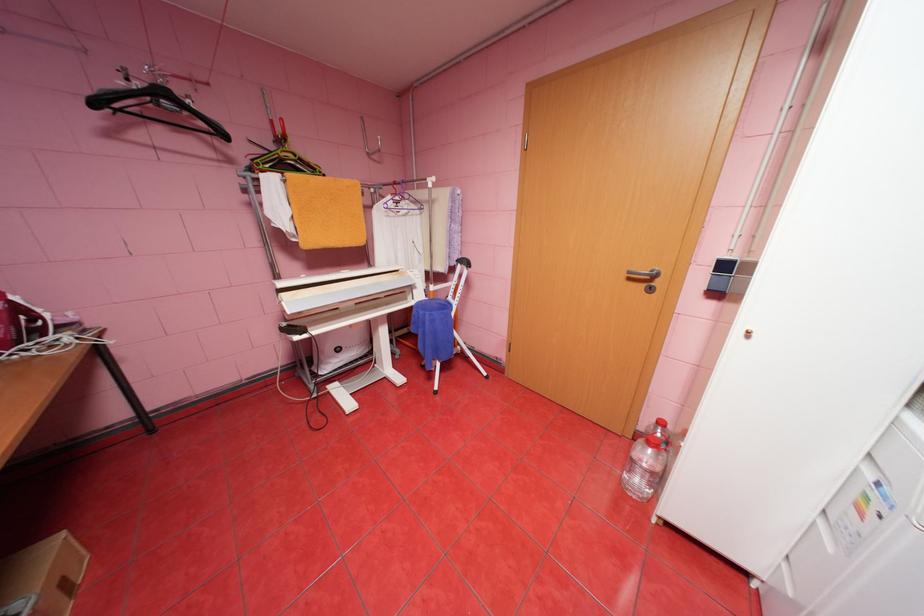
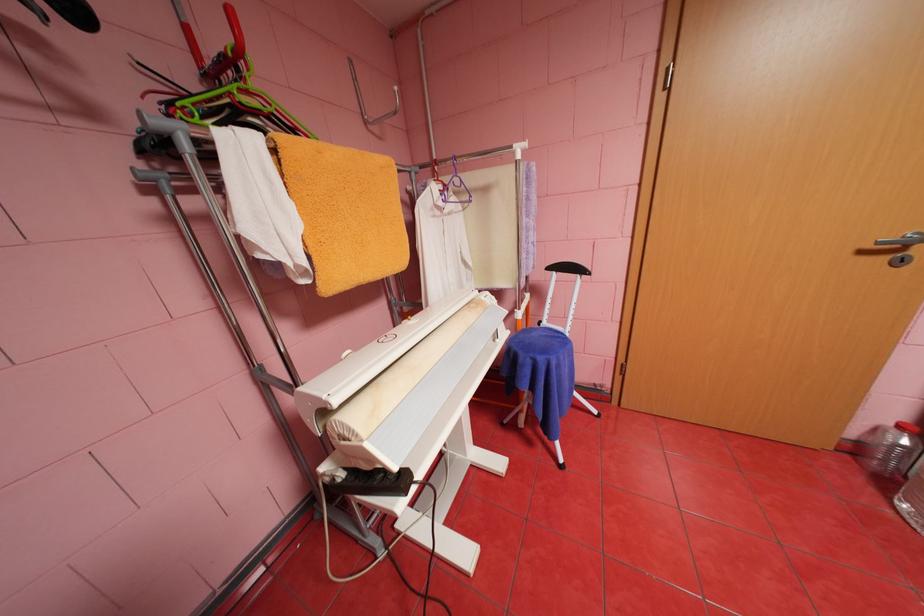
What movement of the cameraman would produce the second image?

The cameraman moved toward left, forward.